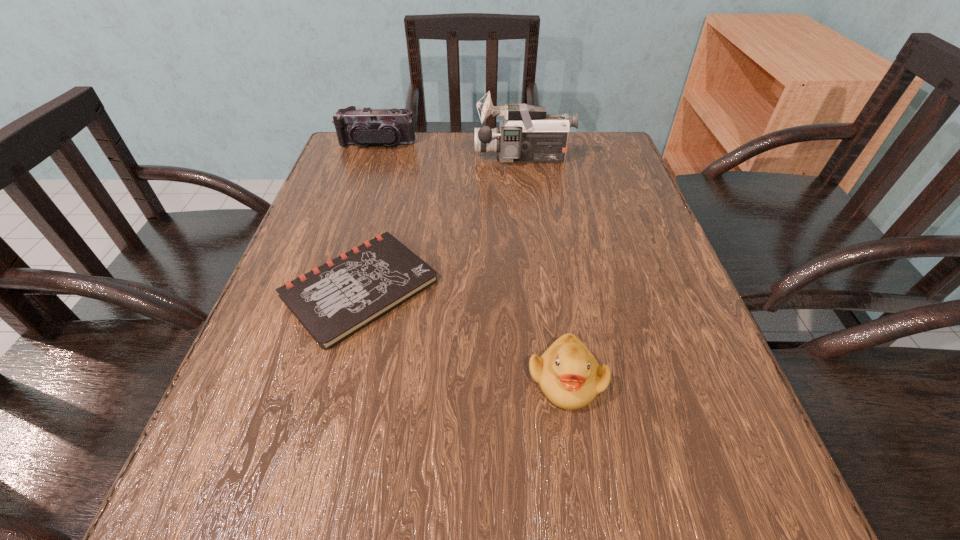
You are a GUI agent. You are given a task and a screenshot of the screen. Output one action in this format:
    pyautogui.click(x=<x>, y=<y>)
    Task: Click on the free area in between the shortest object and the duckling
    The image size is (960, 540).
    Given the screenshot: What is the action you would take?
    pyautogui.click(x=463, y=334)

Where is `unoccupied area between the right camcorder and the shorter camcorder`? This screenshot has width=960, height=540. unoccupied area between the right camcorder and the shorter camcorder is located at coordinates (450, 151).

Image resolution: width=960 pixels, height=540 pixels. Identify the location of blank region between the shorter camcorder and the notebook. (369, 217).

This screenshot has width=960, height=540. In order to click on empty space between the left camcorder and the shortest object in this screenshot , I will do `click(369, 217)`.

You are a GUI agent. You are given a task and a screenshot of the screen. Output one action in this format:
    pyautogui.click(x=<x>, y=<y>)
    Task: Click on the free space between the notebook and the duckling
    
    Given the screenshot: What is the action you would take?
    pyautogui.click(x=463, y=334)

This screenshot has width=960, height=540. I want to click on vacant area that lies between the duckling and the shortest object, so [x=463, y=334].

The height and width of the screenshot is (540, 960). Find the location of `free area in between the left camcorder and the notebook`. free area in between the left camcorder and the notebook is located at coordinates (369, 217).

Identify the location of vacant region between the notebook and the shorter camcorder. The height and width of the screenshot is (540, 960). (369, 217).

Locate an element on the screen. This screenshot has width=960, height=540. free space between the shortest object and the duckling is located at coordinates (463, 334).

Find the location of `vacant space that's between the left camcorder and the duckling`. vacant space that's between the left camcorder and the duckling is located at coordinates (471, 262).